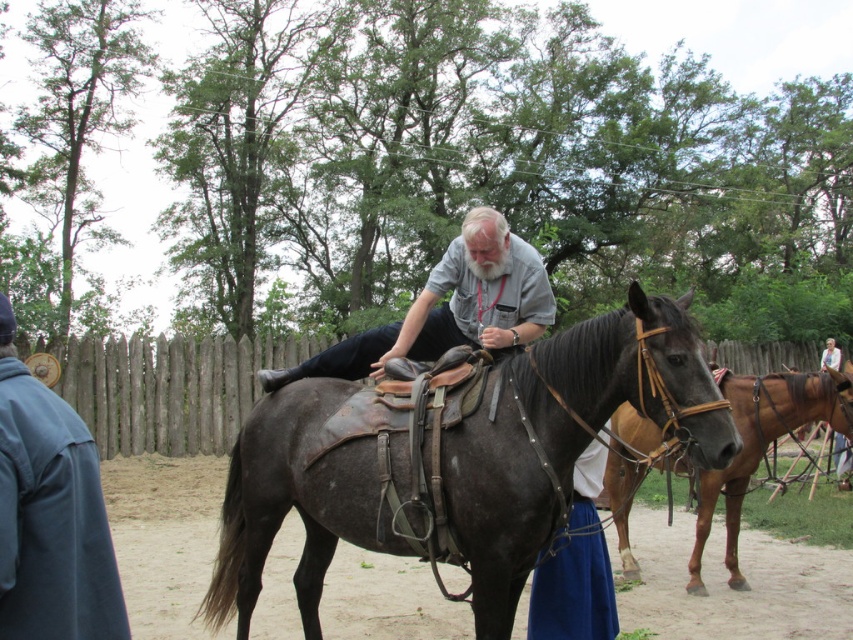
Question: Is brown leather horse at center thinner than light brown leather jacket at center?

Choices:
 (A) no
 (B) yes

Answer: (A)

Question: Which point is closer to the camera?

Choices:
 (A) brown leather horse at center
 (B) blue fabric jacket at left
 (C) light brown leather jacket at center
 (D) gray matte shirt at center

Answer: (B)

Question: From the image, what is the correct spatial relationship of brown leather horse at center in relation to blue cotton skirt at lower center?

Choices:
 (A) right
 (B) left

Answer: (A)

Question: Which point is farther from the camera taking this photo?

Choices:
 (A) (828, 352)
 (B) (67, 440)

Answer: (A)

Question: Which point is farther to the camera?

Choices:
 (A) (628, 490)
 (B) (583, 339)

Answer: (A)

Question: Does dark brown leather horse at center have a larger size compared to blue fabric jacket at left?

Choices:
 (A) no
 (B) yes

Answer: (B)